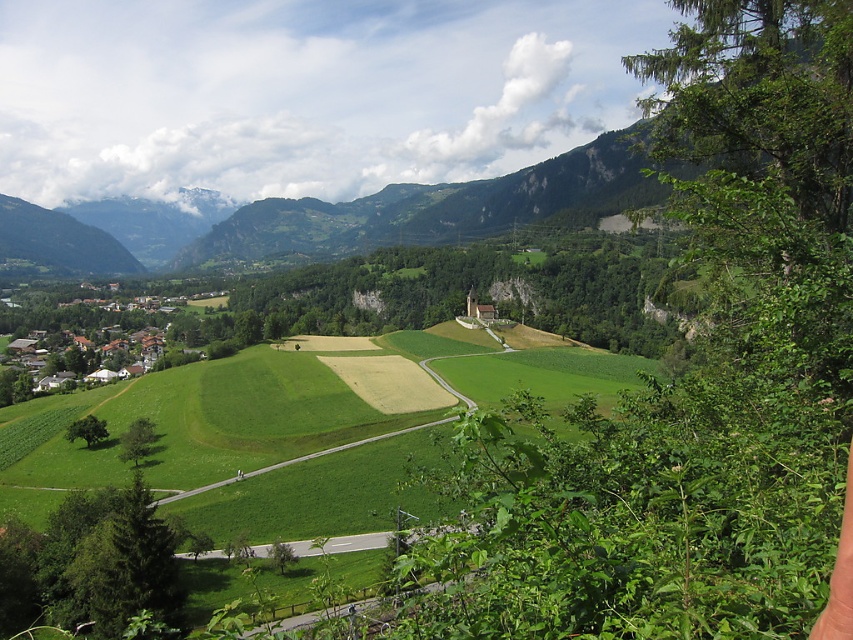
Question: Is green grass field at center to the right of white wooden houses at lower left from the viewer's perspective?

Choices:
 (A) yes
 (B) no

Answer: (A)

Question: Does green grass field at center have a smaller size compared to white wooden houses at lower left?

Choices:
 (A) no
 (B) yes

Answer: (B)

Question: Which point is farther to the camera?

Choices:
 (A) white wooden houses at lower left
 (B) green grass field at center

Answer: (A)

Question: Is green grass field at center wider than white wooden houses at lower left?

Choices:
 (A) no
 (B) yes

Answer: (A)

Question: Which point appears farthest from the camera in this image?

Choices:
 (A) (128, 340)
 (B) (320, 371)

Answer: (A)

Question: Which of the following is the farthest from the observer?

Choices:
 (A) white wooden houses at lower left
 (B) green grass field at center

Answer: (A)